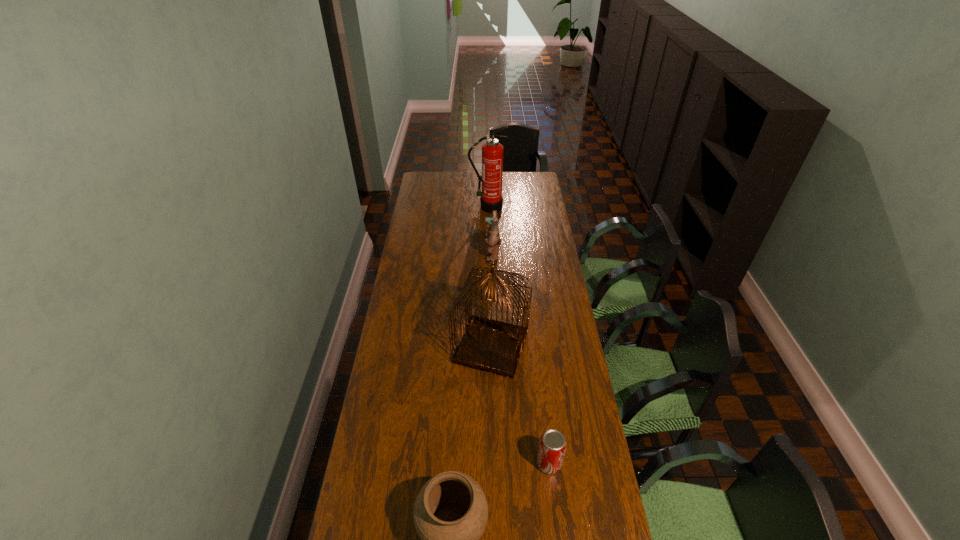
In order to click on vacant position in the image that satisfies the following two spatial constraints: 1. on the front-facing side of the soda can; 2. on the left side of the third shortest object in this screenshot , I will do `click(498, 463)`.

Identify the location of vacant area that satisfies the following two spatial constraints: 1. on the front-facing side of the farthest object; 2. on the left side of the soda can. (492, 463).

At what (x,y) coordinates should I click in order to perform the action: click on vacant area in the image that satisfies the following two spatial constraints: 1. on the front-facing side of the second nearest object; 2. on the left side of the fire extinguisher. Please return your answer as a coordinate pair (x, y). Looking at the image, I should click on (492, 463).

Identify the location of free location that satisfies the following two spatial constraints: 1. on the front-facing side of the second nearest object; 2. on the left side of the fire extinguisher. (492, 463).

The width and height of the screenshot is (960, 540). I want to click on vacant space that satisfies the following two spatial constraints: 1. on the front-facing side of the fire extinguisher; 2. on the left side of the third farthest object, so click(x=491, y=347).

Where is `vacant space that satisfies the following two spatial constraints: 1. on the front side of the birdcage; 2. on the left side of the shortest object`? The height and width of the screenshot is (540, 960). vacant space that satisfies the following two spatial constraints: 1. on the front side of the birdcage; 2. on the left side of the shortest object is located at coordinates (493, 463).

Where is `free point that satisfies the following two spatial constraints: 1. on the front-facing side of the third nearest object; 2. on the left side of the fire extinguisher`? This screenshot has height=540, width=960. free point that satisfies the following two spatial constraints: 1. on the front-facing side of the third nearest object; 2. on the left side of the fire extinguisher is located at coordinates (491, 347).